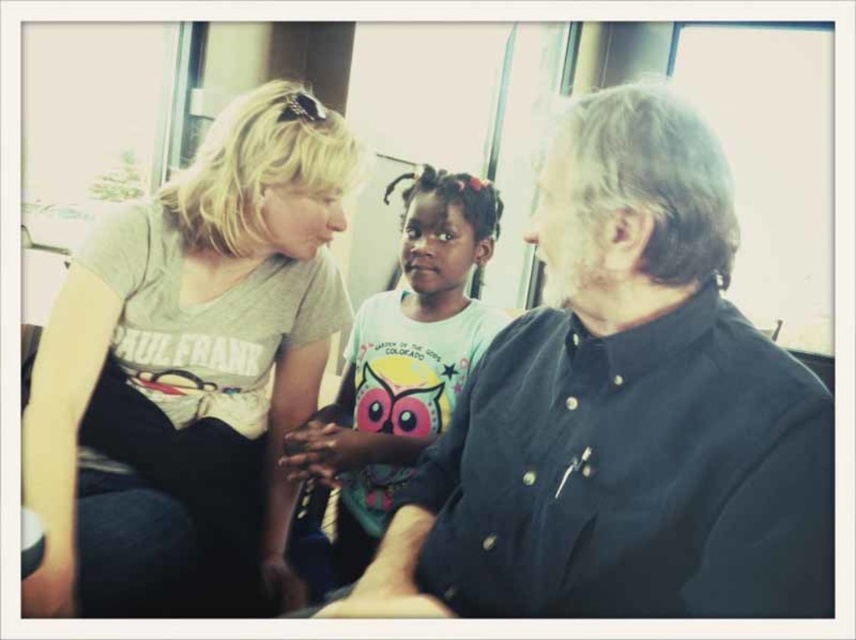
You are a passenger on this vehicle and want to place a small bag between the two points labeled point (696, 314) and point (431, 243). Based on their positions, will the bag be closer to the front or the back of the vehicle?

The bag will be closer to the front of the vehicle because point (696, 314) is in front of point (431, 243), so placing the bag between them would position it nearer to the front.